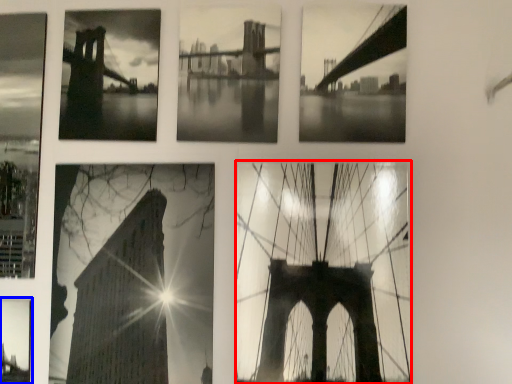
Question: Which object is closer to the camera taking this photo, picture frame (highlighted by a red box) or picture frame (highlighted by a blue box)?

Choices:
 (A) picture frame
 (B) picture frame

Answer: (A)